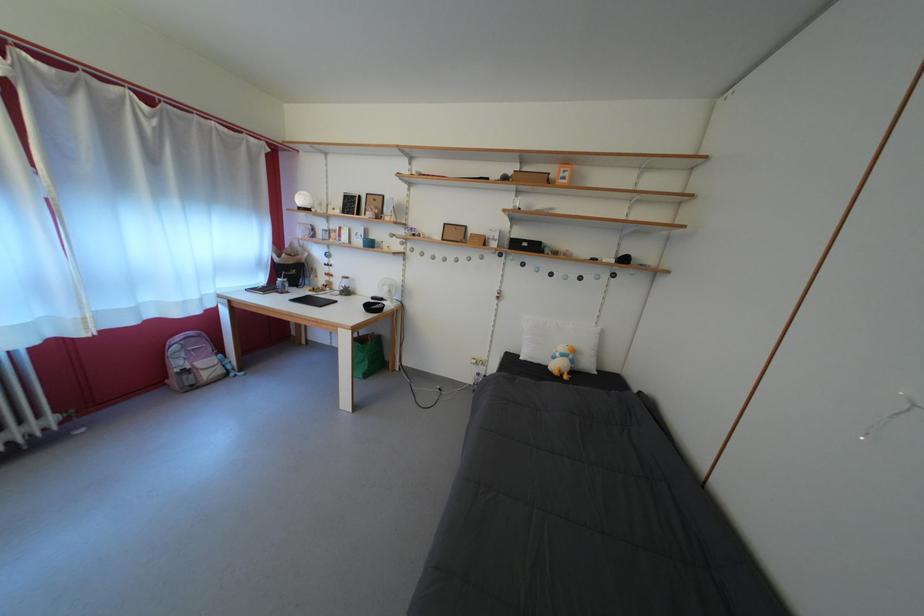
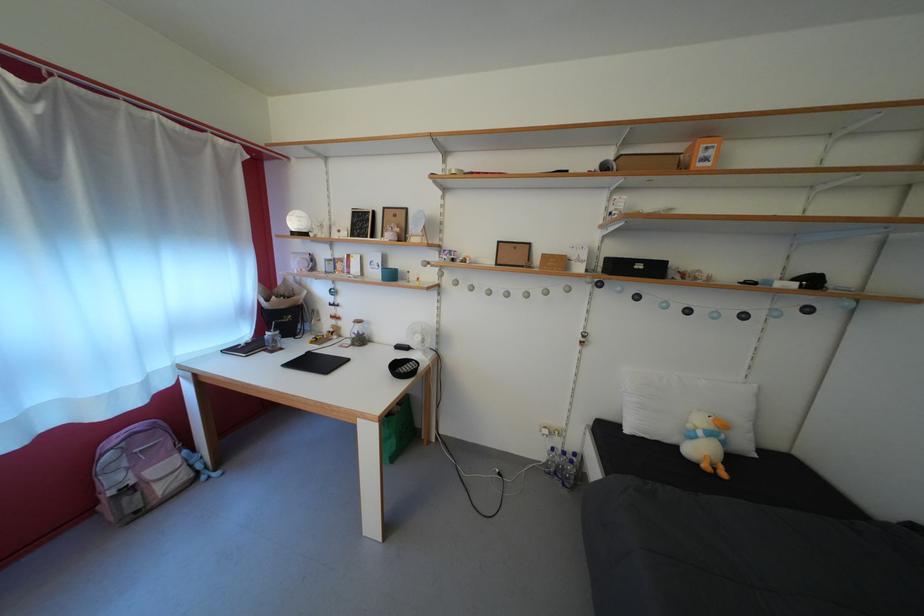
In the second image, find the point that corresponds to point 282,286 in the first image.

(268, 339)